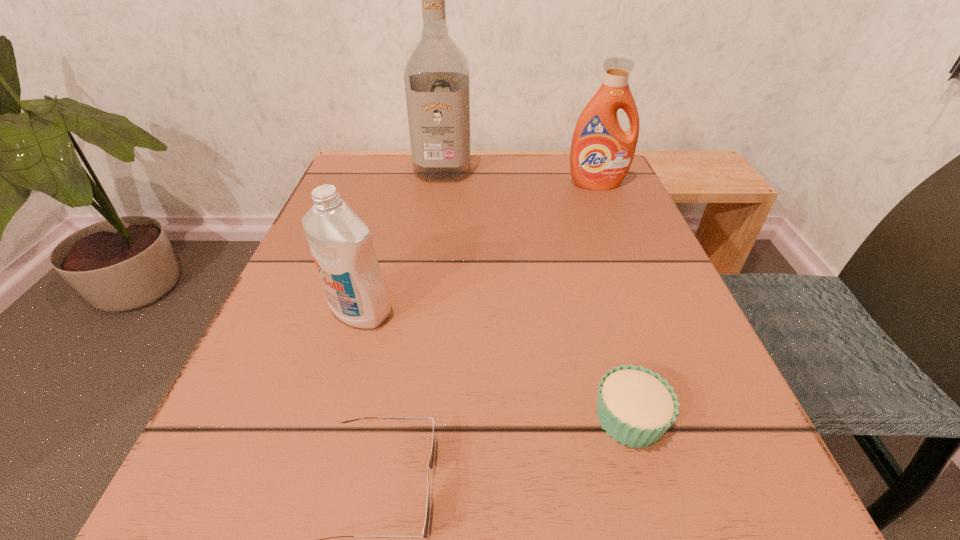
Identify the location of the tallest object. (437, 86).

I want to click on the taller detergent, so click(601, 154).

You are a GUI agent. You are given a task and a screenshot of the screen. Output one action in this format:
    pyautogui.click(x=<x>, y=<y>)
    Task: Click on the fourth shortest object
    
    Given the screenshot: What is the action you would take?
    pyautogui.click(x=601, y=154)

Identify the location of the third nearest object. (340, 242).

Locate an element on the screen. The image size is (960, 540). the third tallest object is located at coordinates click(340, 242).

Where is `the fourth tallest object`? the fourth tallest object is located at coordinates (635, 406).

Find the location of `free space located on the front-facing side of the tallest object`. free space located on the front-facing side of the tallest object is located at coordinates (427, 294).

Where is `vacant region located 0.220m on the front-facing side of the farther detergent`? vacant region located 0.220m on the front-facing side of the farther detergent is located at coordinates (624, 254).

Image resolution: width=960 pixels, height=540 pixels. Find the location of `free space located 0.070m on the left of the third farthest object`. free space located 0.070m on the left of the third farthest object is located at coordinates (279, 312).

Where is `free space located on the left of the second shortest object`? free space located on the left of the second shortest object is located at coordinates (294, 418).